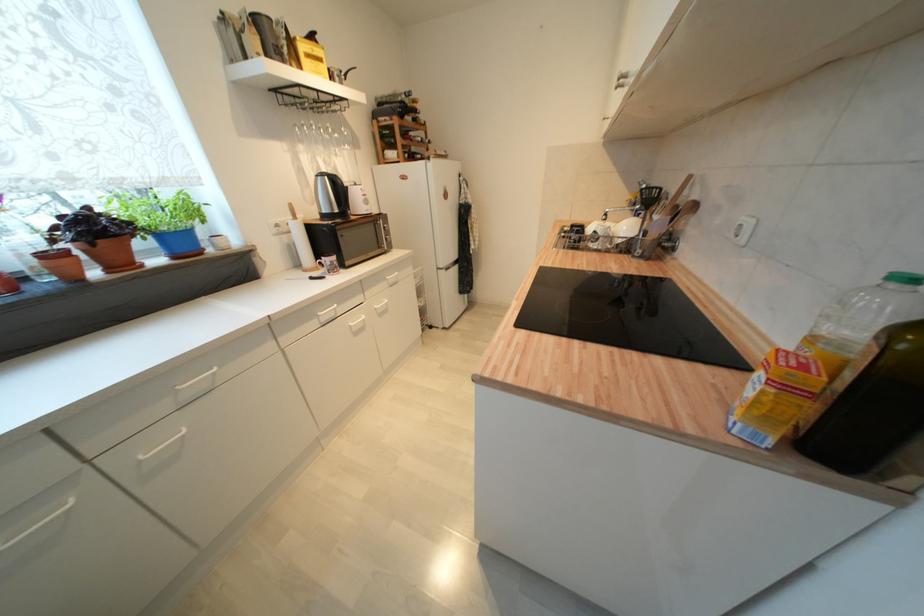
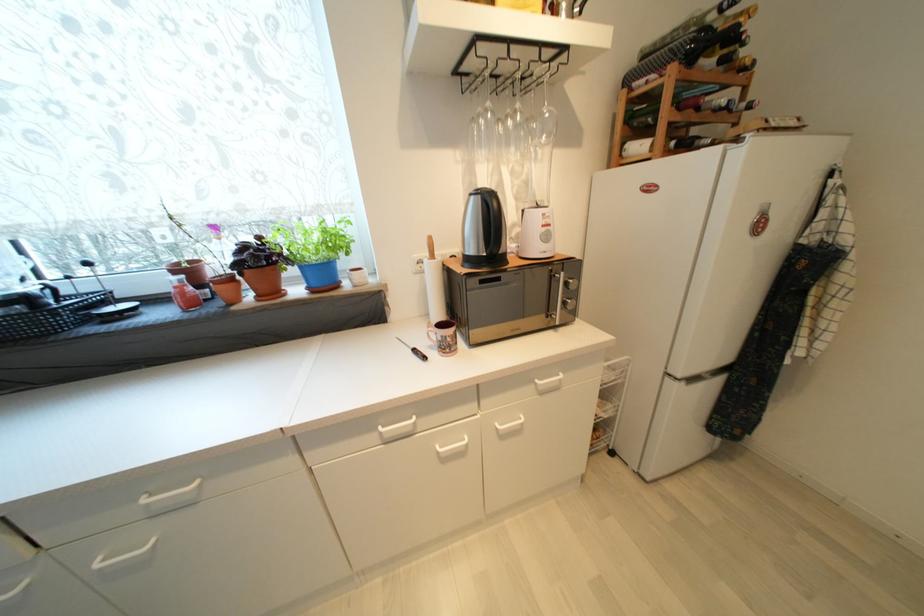
Question: The first image is from the beginning of the video and the second image is from the end. How did the camera likely rotate when shooting the video?

Choices:
 (A) Left
 (B) Right
 (C) Up
 (D) Down

Answer: (A)